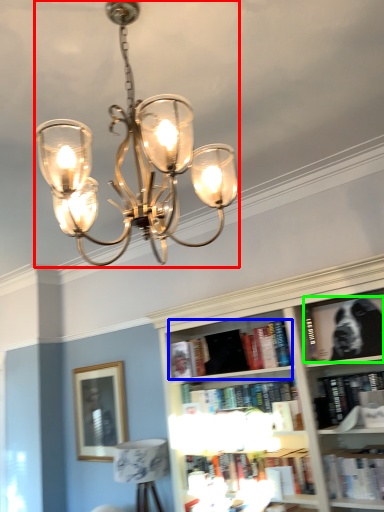
Question: Which object is the farthest from lamp (highlighted by a red box)? Choose among these: book (highlighted by a blue box) or book (highlighted by a green box).

Choices:
 (A) book
 (B) book

Answer: (A)